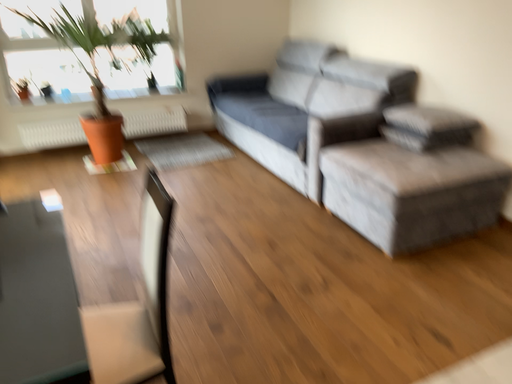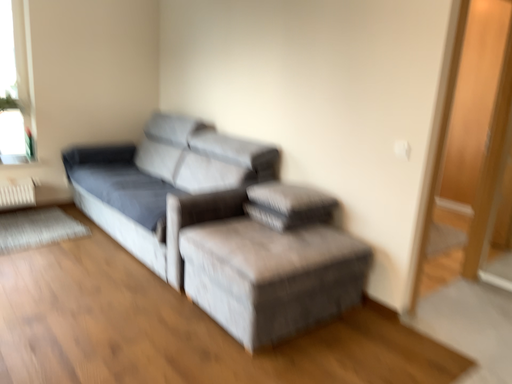
Question: How did the camera likely rotate when shooting the video?

Choices:
 (A) rotated upward
 (B) rotated downward

Answer: (A)